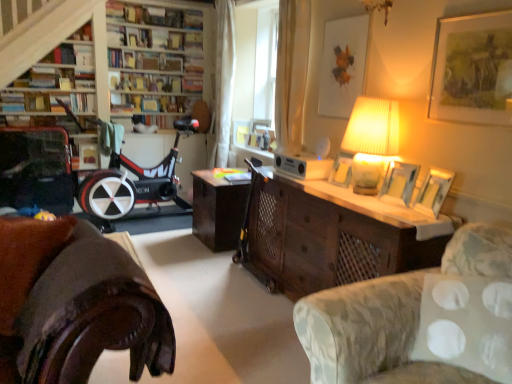
Question: Would you say hardcover book at upper left, which is counted as the fifth book, starting from the back, is part of hardcover book at upper center, positioned as the third book in back-to-front order,'s contents?

Choices:
 (A) yes
 (B) no

Answer: (B)

Question: Is hardcover book at upper center, marked as the 3th book in a front-to-back arrangement, closer to camera compared to hardcover book at upper left, the first book in the front-to-back sequence?

Choices:
 (A) no
 (B) yes

Answer: (A)

Question: Could you tell me if hardcover book at upper center, positioned as the third book in back-to-front order, is turned towards hardcover book at upper left, the first book in the front-to-back sequence?

Choices:
 (A) yes
 (B) no

Answer: (B)

Question: Does hardcover book at upper center, marked as the 3th book in a front-to-back arrangement, appear on the left side of hardcover book at upper left, the first book in the front-to-back sequence?

Choices:
 (A) yes
 (B) no

Answer: (B)

Question: Is hardcover book at upper center, positioned as the third book in back-to-front order, next to hardcover book at upper left, which is counted as the fifth book, starting from the back, and touching it?

Choices:
 (A) no
 (B) yes

Answer: (A)

Question: Considering the relative sizes of hardcover book at upper center, marked as the 3th book in a front-to-back arrangement, and hardcover book at upper left, which is counted as the fifth book, starting from the back, in the image provided, is hardcover book at upper center, marked as the 3th book in a front-to-back arrangement, smaller than hardcover book at upper left, which is counted as the fifth book, starting from the back,?

Choices:
 (A) no
 (B) yes

Answer: (A)

Question: Can you confirm if wooden desk at center is smaller than wooden picture frame at right, arranged as the fourth picture frame when viewed from the back?

Choices:
 (A) no
 (B) yes

Answer: (A)

Question: Is wooden desk at center not inside wooden picture frame at right, arranged as the fourth picture frame when viewed from the back?

Choices:
 (A) yes
 (B) no

Answer: (A)

Question: Is wooden desk at center looking in the opposite direction of wooden picture frame at right, arranged as the fourth picture frame when viewed from the back?

Choices:
 (A) no
 (B) yes

Answer: (A)

Question: Is wooden desk at center positioned behind wooden picture frame at right, arranged as the fourth picture frame when viewed from the back?

Choices:
 (A) yes
 (B) no

Answer: (B)

Question: From a real-world perspective, is wooden desk at center positioned over wooden picture frame at right, which is the 2th picture frame from front to back, based on gravity?

Choices:
 (A) no
 (B) yes

Answer: (A)

Question: Does wooden desk at center have a lesser width compared to wooden picture frame at right, arranged as the fourth picture frame when viewed from the back?

Choices:
 (A) yes
 (B) no

Answer: (B)

Question: From the image's perspective, is matte yellow lampshade at upper right below wooden bookshelf at upper left?

Choices:
 (A) no
 (B) yes

Answer: (B)